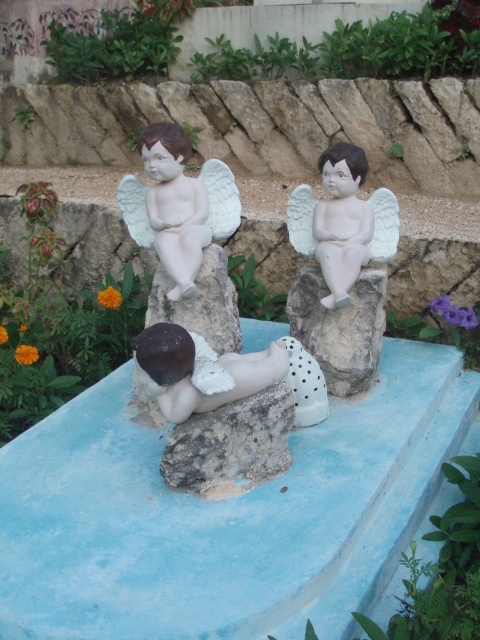
Who is lower down, white matte angel at center or gray rough stone at center?

Positioned lower is gray rough stone at center.

In the scene shown: Between white matte angel at center and gray rough stone at center, which one appears on the right side from the viewer's perspective?

white matte angel at center is more to the right.

Is point (357, 150) farther from viewer compared to point (275, 422)?

Yes, it is.

Find the location of a particular element. This screenshot has width=480, height=640. white matte angel at center is located at coordinates (343, 221).

Is gray rough stone at center taller than white matte stone at upper right?

In fact, gray rough stone at center may be shorter than white matte stone at upper right.

Does gray rough stone at center appear on the right side of white matte stone at upper right?

In fact, gray rough stone at center is to the left of white matte stone at upper right.

Where is `gray rough stone at center`? The image size is (480, 640). gray rough stone at center is located at coordinates (230, 442).

Identify the location of gray rough stone at center. (230, 442).

Who is more distant from viewer, [347,275] or [315,300]?

The point [315,300] is behind.

Where is `white matte angel at center`? The image size is (480, 640). white matte angel at center is located at coordinates (343, 221).